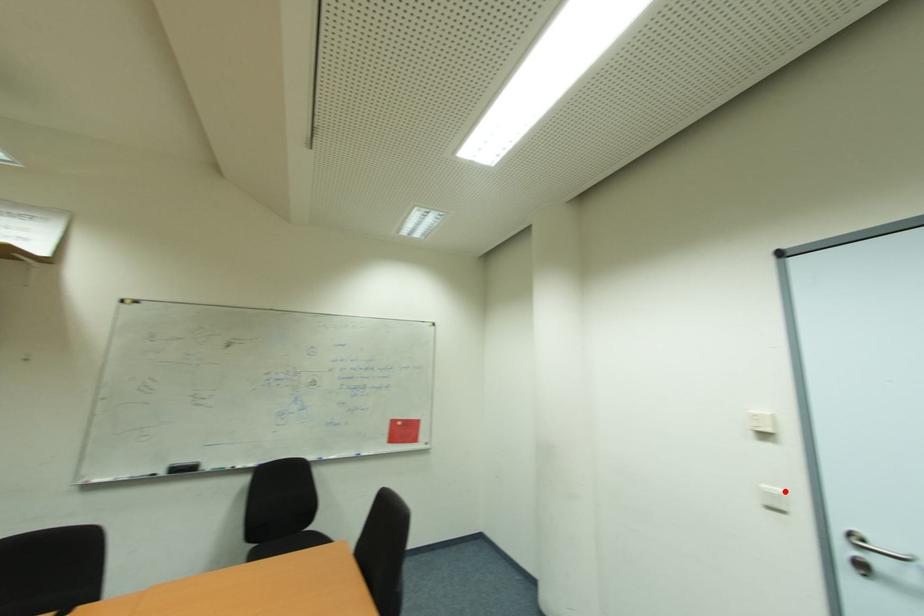
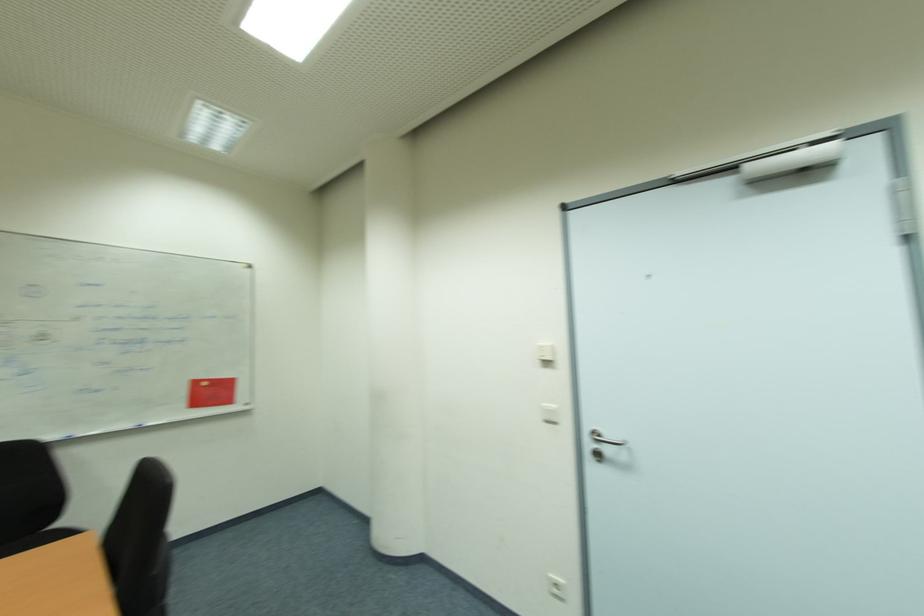
In the second image, find the point that corresponds to the highlighted location in the first image.

(556, 407)